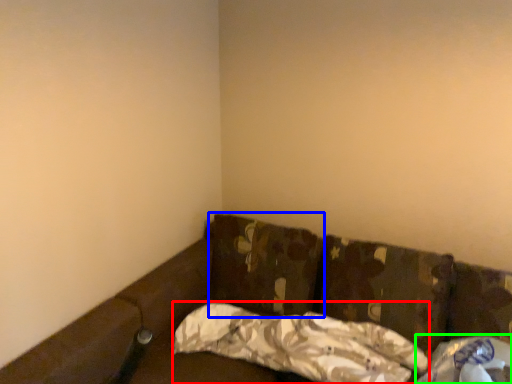
Question: Considering the real-world distances, which object is farthest from pillow (highlighted by a red box)? pillow (highlighted by a blue box) or material (highlighted by a green box)?

Choices:
 (A) pillow
 (B) material

Answer: (B)